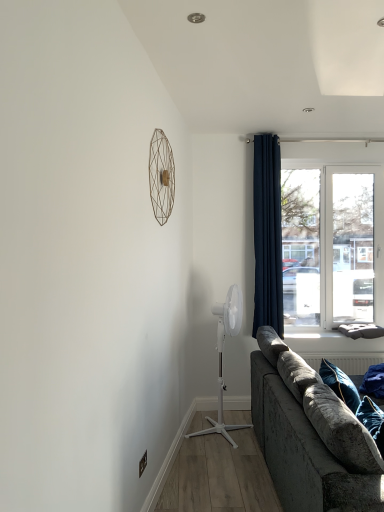
Where is `free space in front of white plastic fan at center, the 2th mechanical fan in the top-to-bottom sequence`? The image size is (384, 512). free space in front of white plastic fan at center, the 2th mechanical fan in the top-to-bottom sequence is located at coordinates (221, 453).